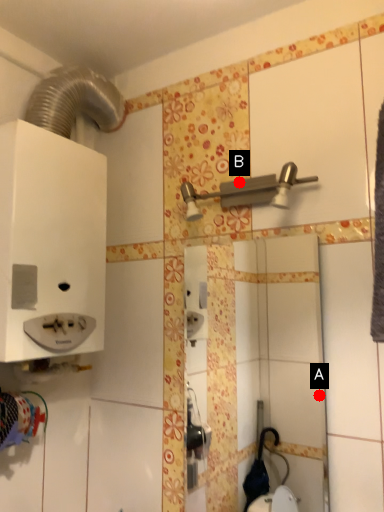
Question: Two points are circled on the image, labeled by A and B beside each circle. Which point is closer to the camera taking this photo?

Choices:
 (A) A is closer
 (B) B is closer

Answer: (B)